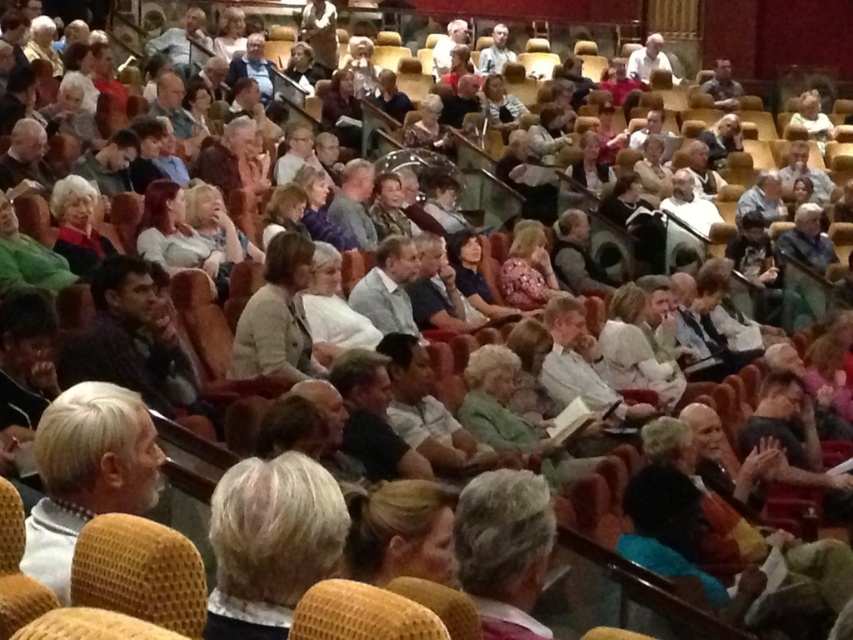
Identify the location of blonde hair at center. This screenshot has width=853, height=640. (271, 541).

Is blonde hair at center wider than light beige fabric jacket at center?

No.

The width and height of the screenshot is (853, 640). What do you see at coordinates (271, 541) in the screenshot? I see `blonde hair at center` at bounding box center [271, 541].

Locate an element on the screen. blonde hair at center is located at coordinates (271, 541).